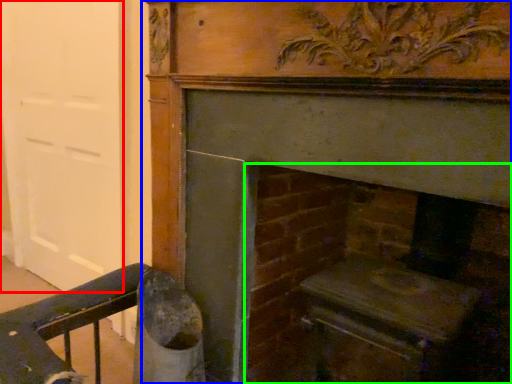
Question: Estimate the real-world distances between objects in this image. Which object is closer to door (highlighted by a red box), fireplace (highlighted by a blue box) or fireplace (highlighted by a green box)?

Choices:
 (A) fireplace
 (B) fireplace

Answer: (A)